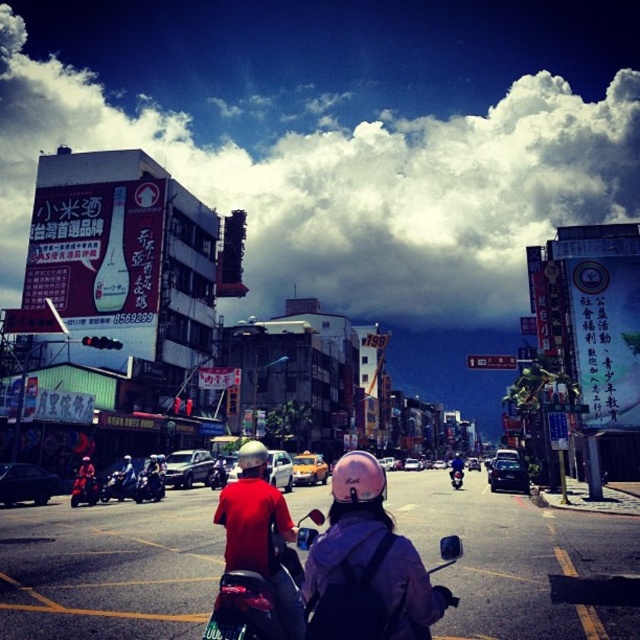
Between red matte helmet at center and shiny red motorcycle at center-left, which one appears on the right side from the viewer's perspective?

red matte helmet at center is more to the right.

Can you confirm if red matte helmet at center is positioned to the left of shiny red motorcycle at center-left?

Incorrect, red matte helmet at center is not on the left side of shiny red motorcycle at center-left.

Where is `red matte helmet at center`? The height and width of the screenshot is (640, 640). red matte helmet at center is located at coordinates (259, 531).

Is point (262, 477) positioned behind point (458, 480)?

That is False.

From the picture: Which is more to the right, red matte helmet at center or metallic pink helmet at center?

From the viewer's perspective, metallic pink helmet at center appears more on the right side.

Where is `red matte helmet at center`? red matte helmet at center is located at coordinates (259, 531).

Is point (80, 486) closer to viewer compared to point (460, 467)?

That is True.

How far apart are shiny red motorcycle at center-left and metallic pink helmet at center?

shiny red motorcycle at center-left and metallic pink helmet at center are 48.94 meters apart from each other.

Who is more distant from viewer, (x=74, y=483) or (x=454, y=481)?

The point (x=454, y=481) is behind.

In order to click on shiny red motorcycle at center-left in this screenshot , I will do `click(84, 486)`.